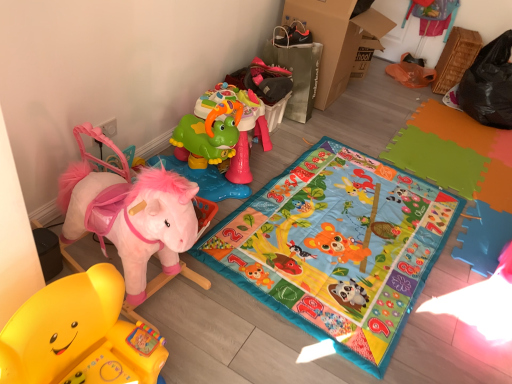
Question: Considering the relative positions of cardboard at upper right and multicolored fabric play mat at center in the image provided, is cardboard at upper right to the left of multicolored fabric play mat at center from the viewer's perspective?

Choices:
 (A) yes
 (B) no

Answer: (B)

Question: Are cardboard at upper right and multicolored fabric play mat at center beside each other?

Choices:
 (A) yes
 (B) no

Answer: (B)

Question: From a real-world perspective, is cardboard at upper right physically above multicolored fabric play mat at center?

Choices:
 (A) yes
 (B) no

Answer: (A)

Question: Could you tell me if cardboard at upper right is facing multicolored fabric play mat at center?

Choices:
 (A) yes
 (B) no

Answer: (B)

Question: Does cardboard at upper right come behind multicolored fabric play mat at center?

Choices:
 (A) no
 (B) yes

Answer: (B)

Question: Is plush pink horse at left, marked as the 2th toy in a back-to-front arrangement, inside the boundaries of cardboard at upper right, or outside?

Choices:
 (A) outside
 (B) inside

Answer: (A)

Question: Is plush pink horse at left, which is the second toy in front-to-back order, in front of or behind cardboard at upper right in the image?

Choices:
 (A) behind
 (B) front

Answer: (B)

Question: Is plush pink horse at left, marked as the 2th toy in a back-to-front arrangement, wider or thinner than cardboard at upper right?

Choices:
 (A) thin
 (B) wide

Answer: (B)

Question: From a real-world perspective, is plush pink horse at left, marked as the 2th toy in a back-to-front arrangement, physically located above or below cardboard at upper right?

Choices:
 (A) below
 (B) above

Answer: (A)

Question: Is point pos(93,201) closer or farther from the camera than point pos(56,289)?

Choices:
 (A) farther
 (B) closer

Answer: (A)

Question: In the image, is plush pink horse at left, marked as the 2th toy in a back-to-front arrangement, positioned in front of or behind rubber yellow rocking horse at lower left, which is the 1th toy from front to back?

Choices:
 (A) behind
 (B) front

Answer: (A)

Question: Looking at their shapes, would you say plush pink horse at left, marked as the 2th toy in a back-to-front arrangement, is wider or thinner than rubber yellow rocking horse at lower left, which is the 1th toy from front to back?

Choices:
 (A) wide
 (B) thin

Answer: (A)

Question: Is plush pink horse at left, which is the second toy in front-to-back order, bigger or smaller than rubber yellow rocking horse at lower left, which is the 1th toy from front to back?

Choices:
 (A) small
 (B) big

Answer: (B)

Question: From a real-world perspective, is plush pink horse at left, marked as the 2th toy in a back-to-front arrangement, physically located above or below green plastic toy at upper center, the third toy positioned from the front?

Choices:
 (A) above
 (B) below

Answer: (A)

Question: Is point (101, 135) positioned closer to the camera than point (194, 148)?

Choices:
 (A) closer
 (B) farther

Answer: (A)